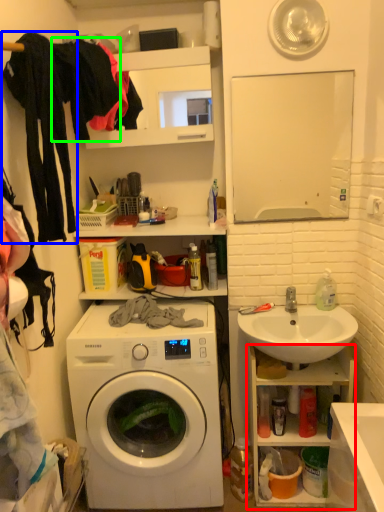
Question: Which is farther away from cabinet (highlighted by a red box)? clothing (highlighted by a blue box) or clothing (highlighted by a green box)?

Choices:
 (A) clothing
 (B) clothing

Answer: (B)